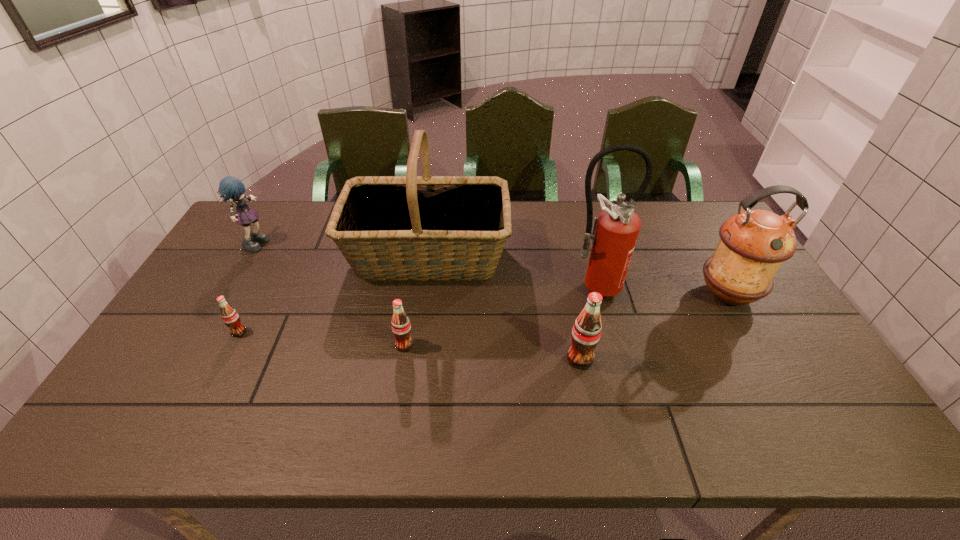
Find the location of a particular element. object at the far left corner is located at coordinates (230, 187).

I want to click on vacant region at the far edge, so (309, 234).

Identify the location of vacant area at the near edge of the desktop. Image resolution: width=960 pixels, height=540 pixels. (382, 377).

The image size is (960, 540). In order to click on vacant space at the left edge of the desktop in this screenshot , I will do `click(214, 270)`.

Find the location of a particular element. vacant space at the right edge of the desktop is located at coordinates (704, 244).

What are the coordinates of `vacant space at the near right corner of the desktop` in the screenshot? It's located at (780, 372).

The width and height of the screenshot is (960, 540). I want to click on vacant area that lies between the tallest soda and the second shortest object, so [x=492, y=352].

Locate an element on the screen. free space between the fire extinguisher and the basket is located at coordinates (510, 271).

Where is `free space between the second shortest object and the rag doll`? The width and height of the screenshot is (960, 540). free space between the second shortest object and the rag doll is located at coordinates (331, 293).

Where is `free spot between the second soda from right to left and the leftmost soda`? The width and height of the screenshot is (960, 540). free spot between the second soda from right to left and the leftmost soda is located at coordinates (322, 339).